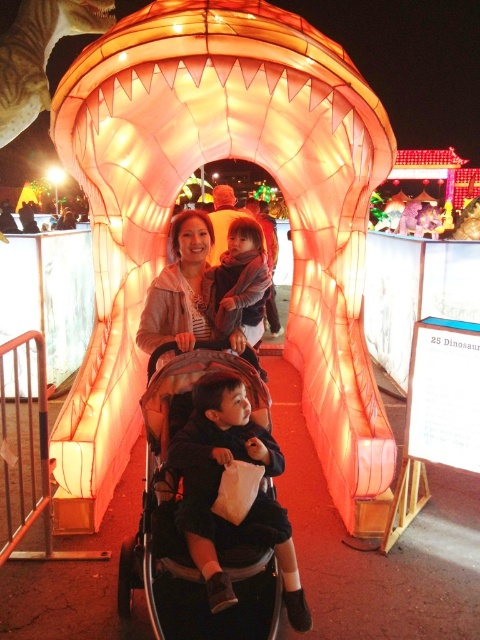
Question: Is black fabric baby carriage at center smaller than matte gray stroller at center?

Choices:
 (A) no
 (B) yes

Answer: (A)

Question: Which object is closer to the camera taking this photo?

Choices:
 (A) black fabric baby carriage at center
 (B) soft pink fabric baby at center

Answer: (A)

Question: Among these objects, which one is nearest to the camera?

Choices:
 (A) black fabric baby carriage at center
 (B) soft pink fabric baby at center
 (C) matte gray stroller at center

Answer: (A)

Question: Estimate the real-world distances between objects in this image. Which object is farther from the matte gray stroller at center?

Choices:
 (A) soft pink fabric baby at center
 (B) black fabric baby carriage at center

Answer: (B)

Question: Can you confirm if black fabric baby carriage at center is thinner than matte gray stroller at center?

Choices:
 (A) no
 (B) yes

Answer: (B)

Question: Can you confirm if matte gray stroller at center is positioned below soft pink fabric baby at center?

Choices:
 (A) yes
 (B) no

Answer: (A)